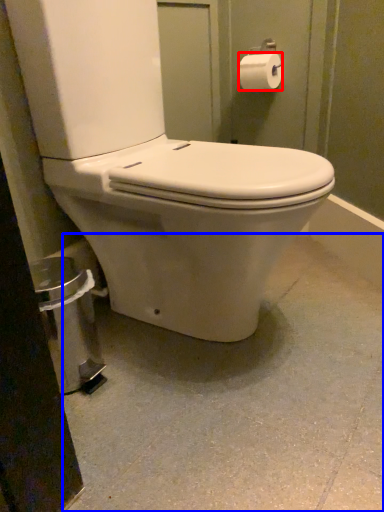
Question: Which of the following is the farthest to the observer, toilet paper (highlighted by a red box) or concrete (highlighted by a blue box)?

Choices:
 (A) toilet paper
 (B) concrete

Answer: (A)